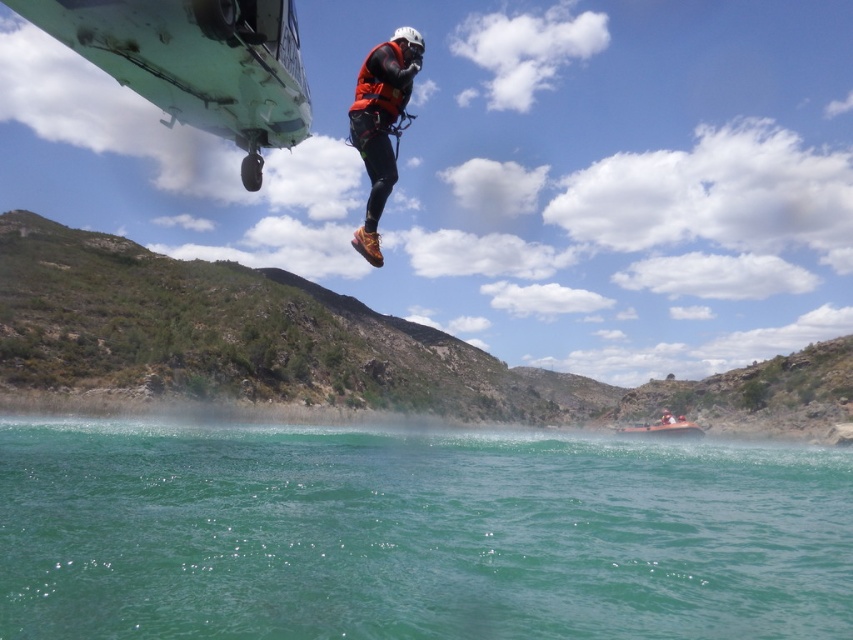
You are a rescue worker planning to lower a life ring from the helicopter to the orange rubber boat at lower right. The orange fabric helmet at upper center is blocking the path. Can you safely lower the life ring to the boat without hitting the helmet?

The orange rubber boat at lower right and orange fabric helmet at upper center are 4.73 meters apart. Since the distance between them is sufficient, you can safely lower the life ring to the boat without hitting the helmet.

From the picture: You are a rescue team member trying to locate two orange items in the water. The orange matte life vest at center and the orange fabric helmet at upper center are both floating. Which item is farther away from the helicopter at the top left corner?

The orange matte life vest at center is farther away from the helicopter at the top left corner because it is 384.17 feet away from the orange fabric helmet at upper center, which is closer to the helicopter.

You are a rescue team member assessing the scene. You see an orange rubber boat at lower right and an orange fabric helmet at upper center. Which object is narrower in width?

The orange rubber boat at lower right is thinner than the orange fabric helmet at upper center, so the orange rubber boat at lower right is narrower in width.